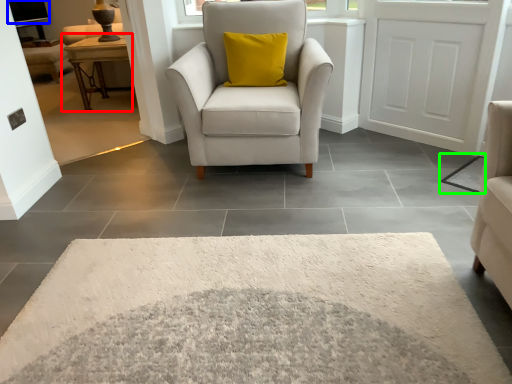
Question: Which object is positioned farthest from table (highlighted by a red box)? Select from window screen (highlighted by a blue box) and mat (highlighted by a green box).

Choices:
 (A) window screen
 (B) mat

Answer: (B)